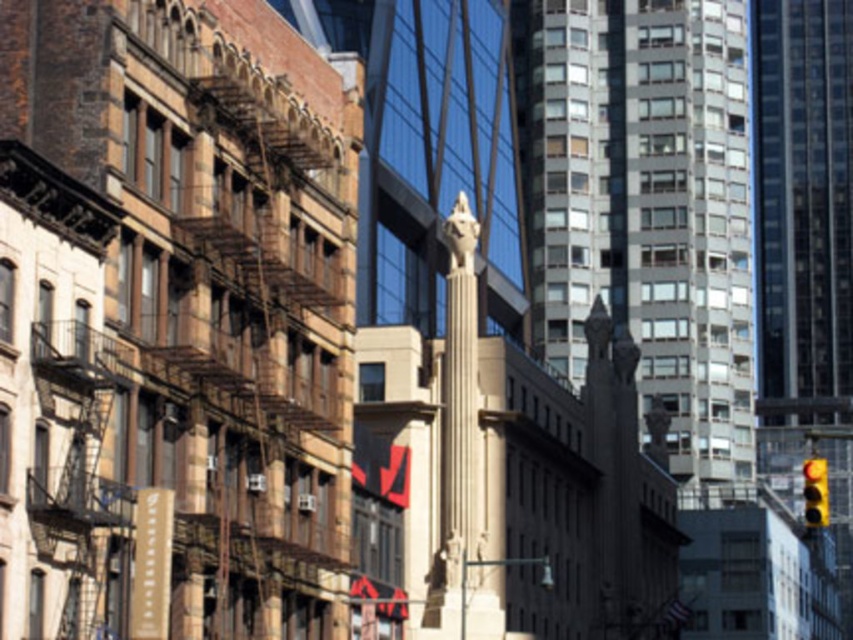
Question: Does gray glass tower at center have a greater width compared to glassy reflective tower at right?

Choices:
 (A) yes
 (B) no

Answer: (A)

Question: Is gray glass tower at center positioned behind glassy reflective tower at right?

Choices:
 (A) no
 (B) yes

Answer: (A)

Question: Which point is farther to the camera?

Choices:
 (A) gray glass tower at center
 (B) glassy reflective tower at right
 (C) yellow matte traffic light at lower right

Answer: (B)

Question: Which point appears farthest from the camera in this image?

Choices:
 (A) (817, 460)
 (B) (695, 138)
 (C) (769, 49)

Answer: (C)

Question: Can you confirm if glassy reflective tower at right is thinner than yellow matte traffic light at lower right?

Choices:
 (A) no
 (B) yes

Answer: (B)

Question: Which object appears closest to the camera in this image?

Choices:
 (A) gray glass tower at center
 (B) yellow matte traffic light at lower right

Answer: (B)